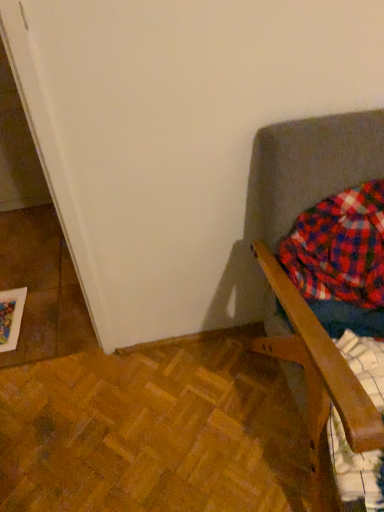
Question: From the image's perspective, is flannel plaid shirt at right above or below wooden chair at right?

Choices:
 (A) above
 (B) below

Answer: (A)

Question: Would you say flannel plaid shirt at right is to the left or to the right of wooden chair at right in the picture?

Choices:
 (A) right
 (B) left

Answer: (B)

Question: Do you think flannel plaid shirt at right is within wooden chair at right, or outside of it?

Choices:
 (A) inside
 (B) outside

Answer: (A)

Question: Is wooden chair at right in front of or behind flannel plaid shirt at right in the image?

Choices:
 (A) behind
 (B) front

Answer: (B)

Question: Considering the relative positions of wooden chair at right and flannel plaid shirt at right in the image provided, is wooden chair at right to the left or to the right of flannel plaid shirt at right?

Choices:
 (A) right
 (B) left

Answer: (A)

Question: Is wooden chair at right bigger or smaller than flannel plaid shirt at right?

Choices:
 (A) big
 (B) small

Answer: (A)

Question: From a real-world perspective, is wooden chair at right positioned above or below flannel plaid shirt at right?

Choices:
 (A) above
 (B) below

Answer: (B)